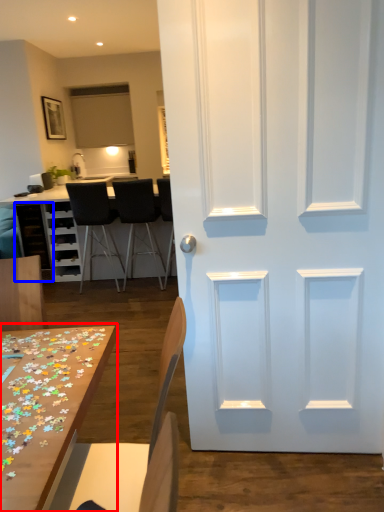
Question: Which point is further to the camera, table (highlighted by a red box) or cabinetry (highlighted by a blue box)?

Choices:
 (A) table
 (B) cabinetry

Answer: (B)